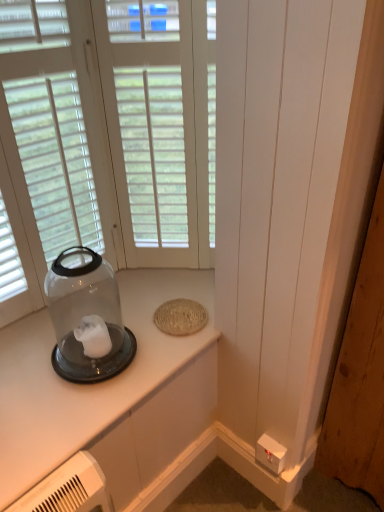
This screenshot has width=384, height=512. What are the coordinates of `vacant space behind transparent glass jar at left` in the screenshot? It's located at (112, 310).